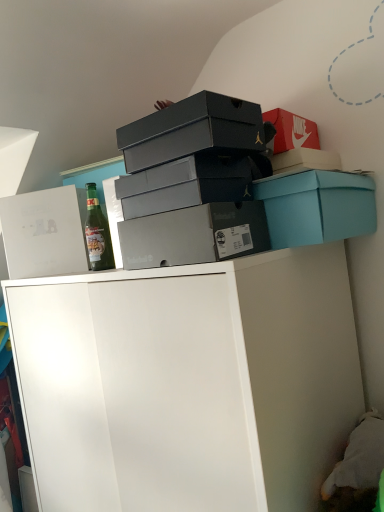
Question: Considering the relative positions of matte black shoebox at upper center, the second box when ordered from left to right, and teal cardboard box at upper right, which is counted as the fifth box, starting from the left, in the image provided, is matte black shoebox at upper center, the second box when ordered from left to right, to the right of teal cardboard box at upper right, which is counted as the fifth box, starting from the left, from the viewer's perspective?

Choices:
 (A) yes
 (B) no

Answer: (B)

Question: Is matte black shoebox at upper center, which is the fourth box from right to left, not within teal cardboard box at upper right, which is counted as the fifth box, starting from the left?

Choices:
 (A) no
 (B) yes

Answer: (B)

Question: Is matte black shoebox at upper center, which is the fourth box from right to left, aimed at teal cardboard box at upper right, which is counted as the fifth box, starting from the left?

Choices:
 (A) no
 (B) yes

Answer: (A)

Question: Considering the relative sizes of matte black shoebox at upper center, the second box when ordered from left to right, and teal cardboard box at upper right, which is counted as the fifth box, starting from the left, in the image provided, is matte black shoebox at upper center, the second box when ordered from left to right, taller than teal cardboard box at upper right, which is counted as the fifth box, starting from the left,?

Choices:
 (A) no
 (B) yes

Answer: (A)

Question: Is matte black shoebox at upper center, the second box when ordered from left to right, positioned in front of teal cardboard box at upper right, arranged as the 1th box when viewed from the right?

Choices:
 (A) yes
 (B) no

Answer: (A)

Question: Would you say white cardboard box at upper left, the fifth box positioned from the right, is to the left or to the right of matte black shoebox at upper center, which is the fourth box from right to left, in the picture?

Choices:
 (A) right
 (B) left

Answer: (B)

Question: From the image's perspective, is white cardboard box at upper left, marked as the 1th box in a left-to-right arrangement, above or below matte black shoebox at upper center, which is the fourth box from right to left?

Choices:
 (A) below
 (B) above

Answer: (A)

Question: Considering the positions of white cardboard box at upper left, the fifth box positioned from the right, and matte black shoebox at upper center, the second box when ordered from left to right, in the image, is white cardboard box at upper left, the fifth box positioned from the right, bigger or smaller than matte black shoebox at upper center, the second box when ordered from left to right,?

Choices:
 (A) small
 (B) big

Answer: (B)

Question: From a real-world perspective, is white cardboard box at upper left, marked as the 1th box in a left-to-right arrangement, physically located above or below matte black shoebox at upper center, which is the fourth box from right to left?

Choices:
 (A) above
 (B) below

Answer: (B)

Question: Is teal cardboard box at upper right, which is counted as the fifth box, starting from the left, in front of or behind matte gray shoebox at center, which appears as the 4th box when viewed from the left, in the image?

Choices:
 (A) behind
 (B) front

Answer: (A)

Question: From a real-world perspective, is teal cardboard box at upper right, which is counted as the fifth box, starting from the left, positioned above or below matte gray shoebox at center, which appears as the 4th box when viewed from the left?

Choices:
 (A) above
 (B) below

Answer: (A)

Question: Is point (306, 178) closer or farther from the camera than point (183, 207)?

Choices:
 (A) farther
 (B) closer

Answer: (A)

Question: Looking at the image, does teal cardboard box at upper right, arranged as the 1th box when viewed from the right, seem bigger or smaller compared to matte gray shoebox at center, placed as the 2th box when sorted from right to left?

Choices:
 (A) small
 (B) big

Answer: (B)

Question: Is white matte cabinet at upper center wider or thinner than white cardboard box at upper left, the fifth box positioned from the right?

Choices:
 (A) wide
 (B) thin

Answer: (A)

Question: From the image's perspective, relative to white cardboard box at upper left, the fifth box positioned from the right, is white matte cabinet at upper center above or below?

Choices:
 (A) below
 (B) above

Answer: (A)